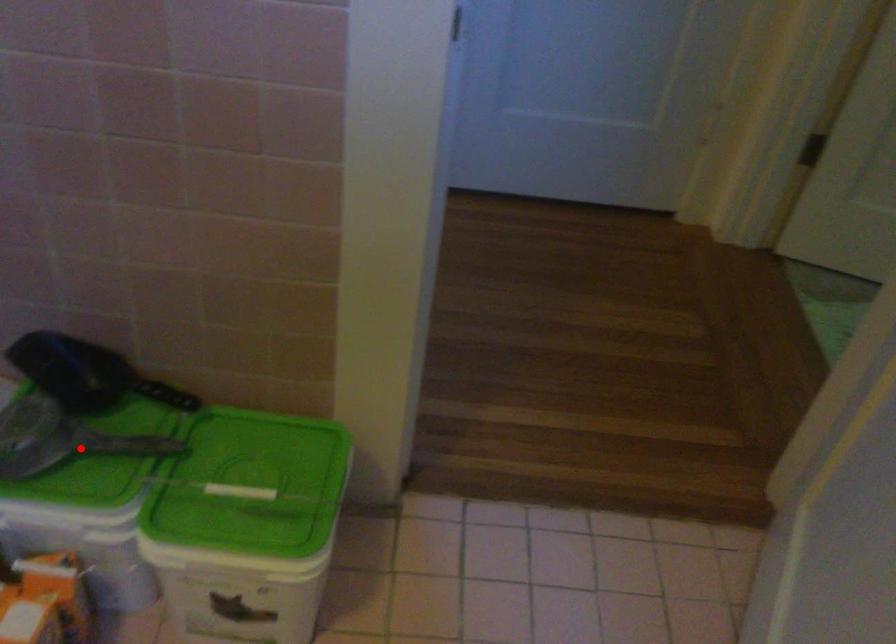
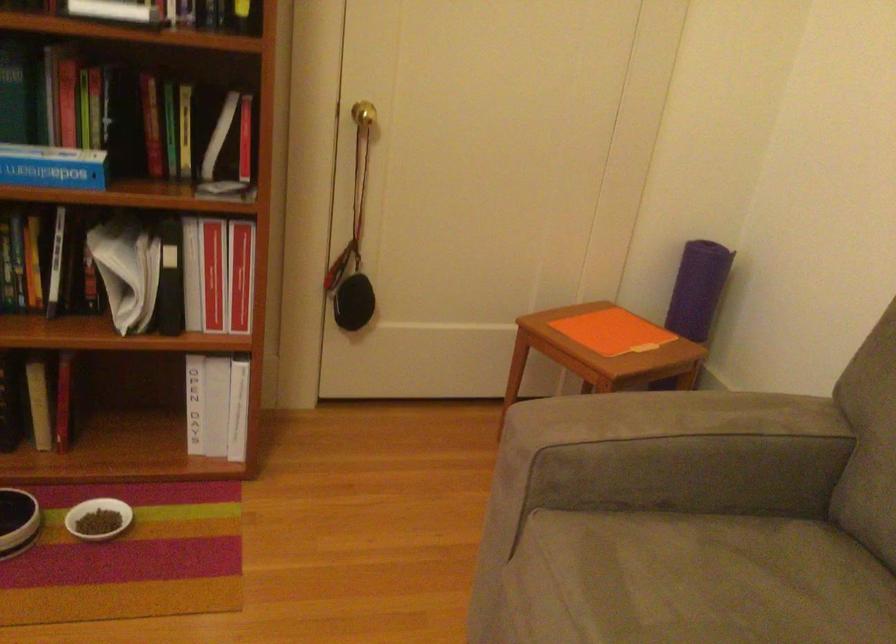
Question: I am providing you with two images of the same scene from different viewpoints. A red point is marked on the first image. Can you still see the location of the red point in image 2?

Choices:
 (A) Yes
 (B) No

Answer: (B)